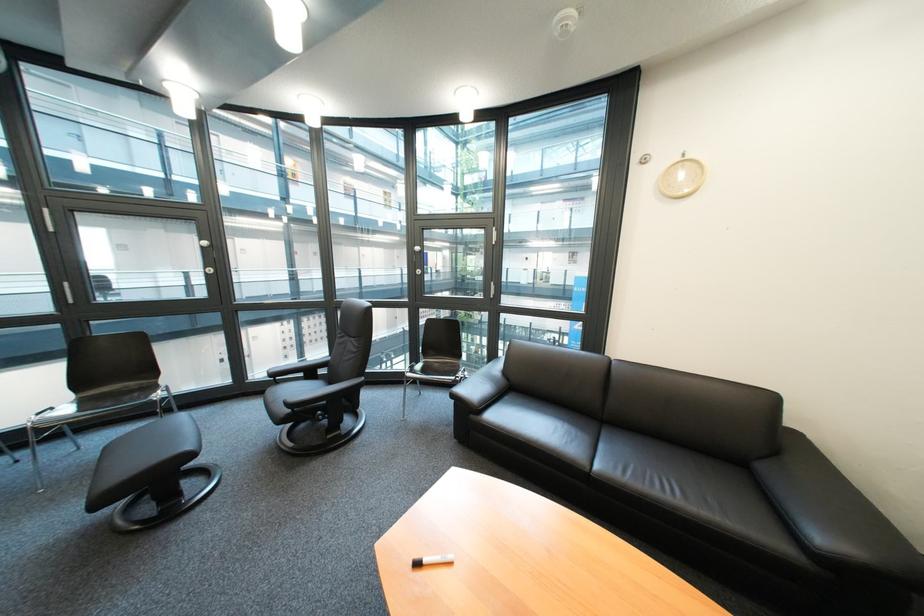
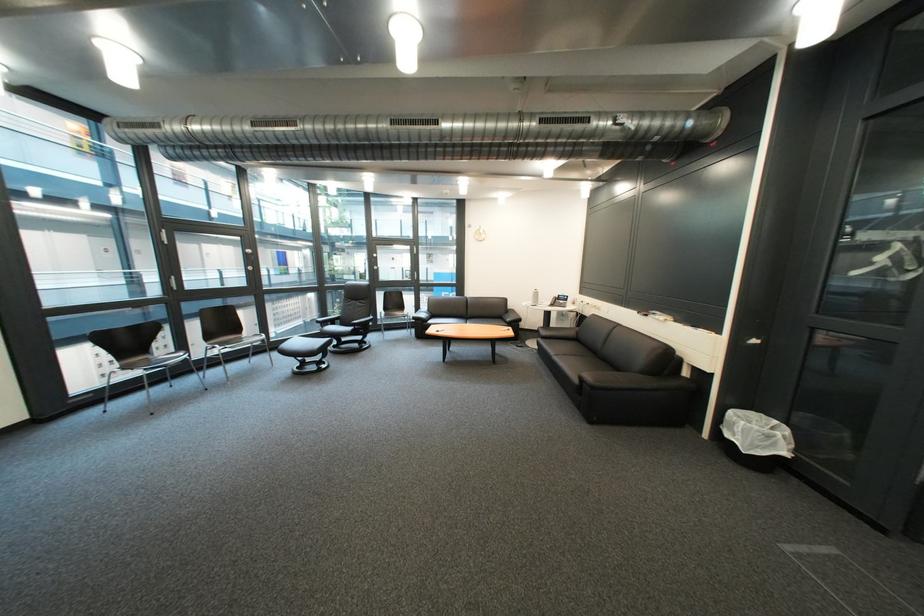
Where in the second image is the point corresponding to (x=287, y=381) from the first image?

(334, 326)